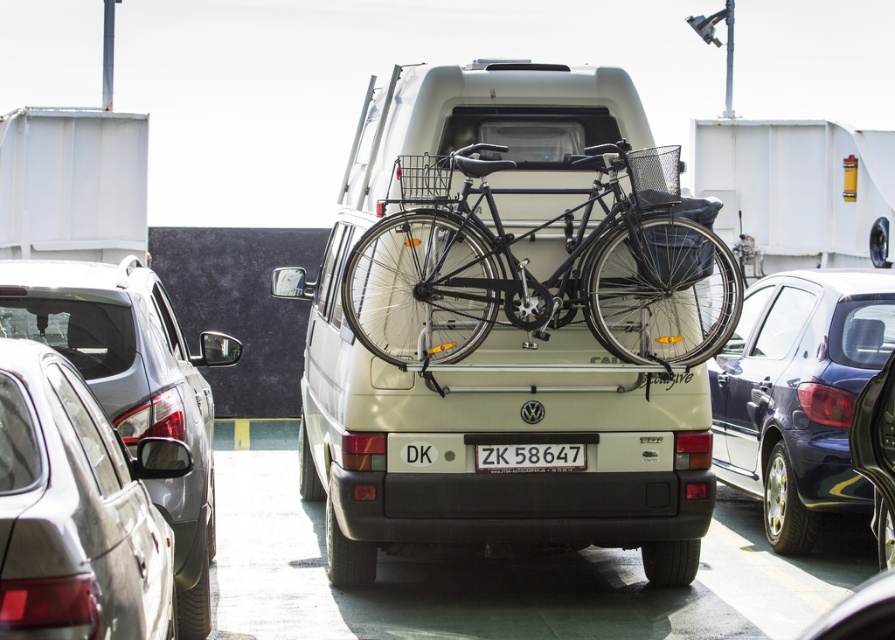
Question: Is shiny black bicycle at center positioned before satin silver car at left?

Choices:
 (A) yes
 (B) no

Answer: (B)

Question: Which point is farther to the camera?

Choices:
 (A) (424, 180)
 (B) (730, 480)

Answer: (B)

Question: Which object is the closest to the satin silver car at left?

Choices:
 (A) black plastic license plate at center
 (B) metallic blue sedan at right
 (C) shiny black bicycle at center

Answer: (C)

Question: Does metallic blue sedan at right come behind black plastic license plate at center?

Choices:
 (A) no
 (B) yes

Answer: (B)

Question: Based on their relative distances, which object is farther from the satin silver car at left?

Choices:
 (A) shiny black bicycle at center
 (B) metallic blue sedan at right
 (C) black plastic license plate at center

Answer: (B)

Question: Does metallic blue sedan at right appear on the right side of shiny black car at right?

Choices:
 (A) no
 (B) yes

Answer: (B)